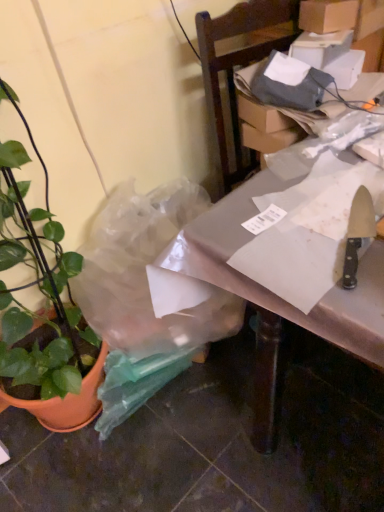
The image size is (384, 512). Identify the location of green matte plant pot at left. (43, 316).

What is the approximate height of metallic silver table at center?

It is 76.19 centimeters.

From the picture: In order to face white paper at right, should I rotate leftwards or rightwards?

To align with it, rotate right about 17.476°.

What do you see at coordinates (327, 15) in the screenshot? I see `cardboard box at upper right` at bounding box center [327, 15].

The width and height of the screenshot is (384, 512). I want to click on polished metal knife at right, so click(358, 234).

Is cardboard box at upper right looking in the opposite direction of metallic silver table at center?

cardboard box at upper right is not turned away from metallic silver table at center.

This screenshot has height=512, width=384. What are the coordinates of `cardboard box above the metallic silver table at center (from a real-world perspective)` in the screenshot? It's located at (327, 15).

From the image's perspective, is cardboard box at upper right above or below metallic silver table at center?

cardboard box at upper right is situated higher than metallic silver table at center in the image.

Which is nearer, [348,19] or [376,333]?

Point [348,19] is farther from the camera than point [376,333].

How far apart are green matte plant pot at left and cardboard box at upper right?

They are 1.12 meters apart.

Which object is further away from the camera, green matte plant pot at left or cardboard box at upper right?

cardboard box at upper right is behind.

Which of these two, green matte plant pot at left or cardboard box at upper right, is wider?

Wider between the two is green matte plant pot at left.

In terms of size, does green matte plant pot at left appear bigger or smaller than cardboard box at upper right?

green matte plant pot at left is bigger than cardboard box at upper right.

In the scene shown: Is white paper at right directly adjacent to metallic silver table at center?

No, white paper at right is not beside metallic silver table at center.

From a real-world perspective, which is physically below, white paper at right or metallic silver table at center?

metallic silver table at center.

Choose the correct answer: Is white paper at right inside metallic silver table at center or outside it?

white paper at right is enclosed within metallic silver table at center.

Considering the sizes of polished metal knife at right and green matte plant pot at left in the image, is polished metal knife at right wider or thinner than green matte plant pot at left?

In the image, polished metal knife at right appears to be more narrow than green matte plant pot at left.

Based on the photo, is polished metal knife at right smaller than green matte plant pot at left?

Correct, polished metal knife at right occupies less space than green matte plant pot at left.

Which point is more forward, (354, 203) or (74, 424)?

Point (354, 203)

From a real-world perspective, is polished metal knife at right positioned above or below green matte plant pot at left?

In terms of real-world spatial position, polished metal knife at right is above green matte plant pot at left.

From the image's perspective, relative to white paper at right, is polished metal knife at right above or below?

Clearly, from the image's perspective, polished metal knife at right is below white paper at right.

Based on the photo, between polished metal knife at right and white paper at right, which one has smaller width?

With smaller width is polished metal knife at right.

Does polished metal knife at right lie in front of white paper at right?

No, polished metal knife at right is behind white paper at right.

This screenshot has height=512, width=384. Find the location of `wrapping paper above the polished metal knife at right (from the image's perspective)`. wrapping paper above the polished metal knife at right (from the image's perspective) is located at coordinates (312, 213).

Between cardboard box at upper right and polished metal knife at right, which one has smaller width?

cardboard box at upper right is thinner.

Is cardboard box at upper right not within polished metal knife at right?

Yes.

Who is taller, cardboard box at upper right or polished metal knife at right?

With more height is cardboard box at upper right.

Considering the positions of objects cardboard box at upper right and polished metal knife at right in the image provided, who is more to the left, cardboard box at upper right or polished metal knife at right?

From the viewer's perspective, polished metal knife at right appears more on the left side.

Is point (351, 21) less distant than point (62, 276)?

No, it is not.

From the image's perspective, which one is positioned higher, cardboard box at upper right or green matte plant pot at left?

cardboard box at upper right appears higher in the image.

Is cardboard box at upper right in contact with green matte plant pot at left?

No, cardboard box at upper right is not making contact with green matte plant pot at left.

From the picture: Considering the relative sizes of cardboard box at upper right and green matte plant pot at left in the image provided, is cardboard box at upper right thinner than green matte plant pot at left?

Yes.

Locate an element on the screen. cardboard box that is above the metallic silver table at center (from the image's perspective) is located at coordinates (327, 15).

In order to click on houseplant below the cardboard box at upper right (from the image's perspective) in this screenshot , I will do `click(43, 316)`.

When comparing their distances from cardboard box at upper right, does polished metal knife at right or metallic silver table at center seem further?

metallic silver table at center.

Which object lies nearer to the anchor point green matte plant pot at left, polished metal knife at right or white paper at right?

white paper at right lies closer to green matte plant pot at left than the other object.

Based on their spatial positions, is green matte plant pot at left or metallic silver table at center closer to cardboard box at upper right?

metallic silver table at center is closer to cardboard box at upper right.

Estimate the real-world distances between objects in this image. Which object is further from metallic silver table at center, white paper at right or green matte plant pot at left?

green matte plant pot at left lies further to metallic silver table at center than the other object.

Looking at the image, which one is located closer to green matte plant pot at left, metallic silver table at center or cardboard box at upper right?

Based on the image, metallic silver table at center appears to be nearer to green matte plant pot at left.

Which object lies nearer to the anchor point green matte plant pot at left, polished metal knife at right or metallic silver table at center?

metallic silver table at center is positioned closer to the anchor green matte plant pot at left.

Based on their spatial positions, is green matte plant pot at left or cardboard box at upper right further from metallic silver table at center?

cardboard box at upper right is positioned further to the anchor metallic silver table at center.

Considering their positions, is green matte plant pot at left positioned further to polished metal knife at right than cardboard box at upper right?

Based on the image, green matte plant pot at left appears to be further to polished metal knife at right.

Where is `kitchen knife located between green matte plant pot at left and cardboard box at upper right in the left-right direction`? The image size is (384, 512). kitchen knife located between green matte plant pot at left and cardboard box at upper right in the left-right direction is located at coordinates (358, 234).

Find the location of a particular element. Image resolution: width=384 pixels, height=512 pixels. wrapping paper situated between green matte plant pot at left and polished metal knife at right from left to right is located at coordinates (312, 213).

Where is `kitchen knife situated between green matte plant pot at left and metallic silver table at center from left to right`? The image size is (384, 512). kitchen knife situated between green matte plant pot at left and metallic silver table at center from left to right is located at coordinates (358, 234).

Locate an element on the screen. wrapping paper between green matte plant pot at left and metallic silver table at center is located at coordinates (312, 213).